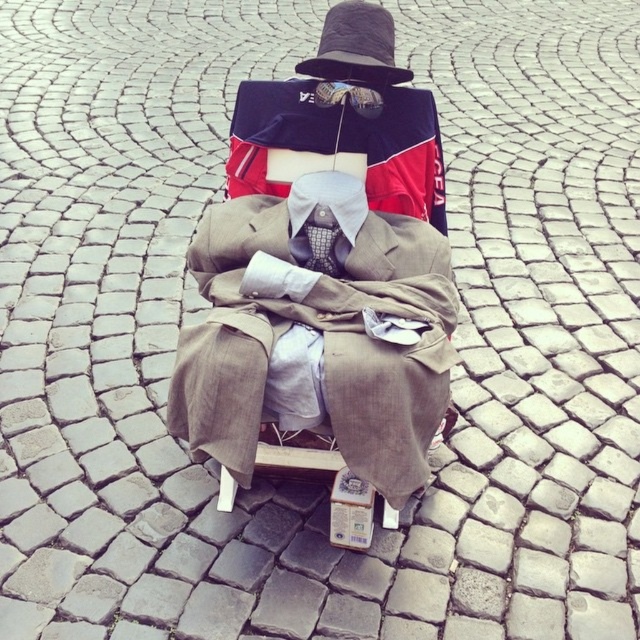
Which is more to the left, red and black jersey at center or silky black tie at center?

silky black tie at center is more to the left.

Does point (253, 97) come farther from viewer compared to point (321, 259)?

Yes, point (253, 97) is behind point (321, 259).

Which is behind, point (396, 124) or point (310, 253)?

The point (396, 124) is more distant.

Find the location of a particular element. The width and height of the screenshot is (640, 640). red and black jersey at center is located at coordinates (339, 141).

Is point (365, 298) positioned in front of point (323, 250)?

That is True.

Is point (205, 337) in front of point (308, 216)?

Yes, it is.

The height and width of the screenshot is (640, 640). I want to click on light brown fabric suit at center, so click(x=317, y=333).

The height and width of the screenshot is (640, 640). I want to click on light brown fabric suit at center, so click(x=317, y=333).

Between light brown fabric suit at center and red and black jersey at center, which one appears on the left side from the viewer's perspective?

light brown fabric suit at center

Does point (205, 220) lie in front of point (262, 148)?

No.

Find the location of a particular element. The height and width of the screenshot is (640, 640). light brown fabric suit at center is located at coordinates coord(317,333).